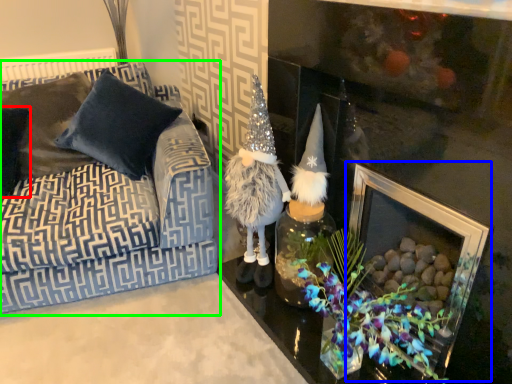
Question: Which object is positioned farthest from pillow (highlighted by a red box)? Select from picture frame (highlighted by a blue box) and studio couch (highlighted by a green box).

Choices:
 (A) picture frame
 (B) studio couch

Answer: (A)